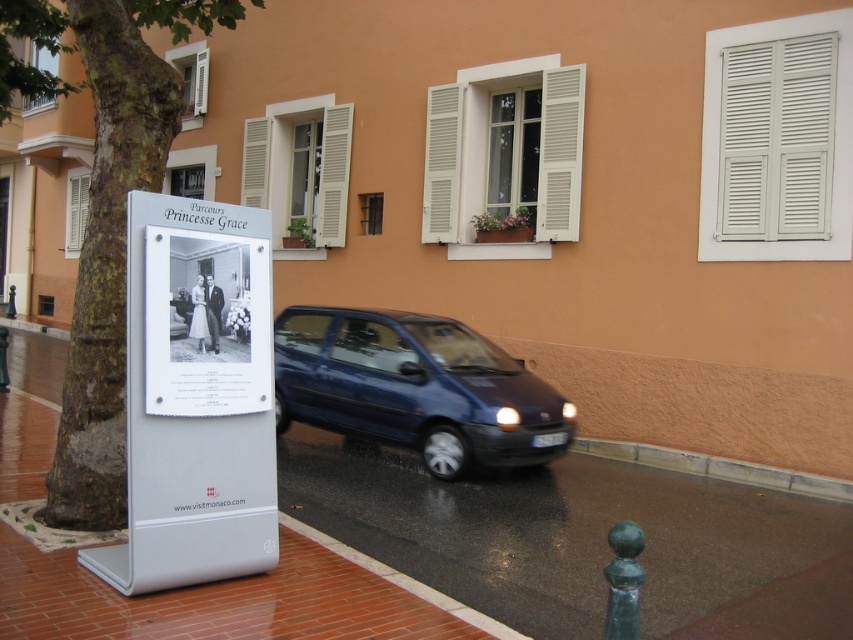
You are standing in front of the peach building and want to walk from point (677, 454) to point (454, 99). Which direction should you move in to get closer to your destination?

You should move to the left and slightly downward because point (454, 99) is located to the left and lower than point (677, 454).

You are a delivery person standing on the brick pavement at lower left and need to place a package on the white matte shutters at center. Can you reach the shutters from your current position without needing a ladder?

The brick pavement at lower left is shorter than the white matte shutters at center, so you would need a ladder to reach the shutters since they are higher up.